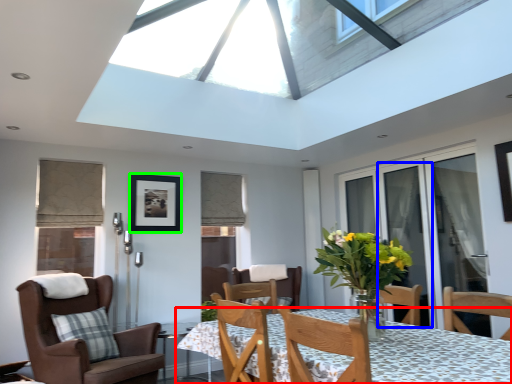
Question: Which object is positioned closest to table (highlighted by a red box)? Select from screen door (highlighted by a blue box) and picture frame (highlighted by a green box).

Choices:
 (A) screen door
 (B) picture frame

Answer: (A)